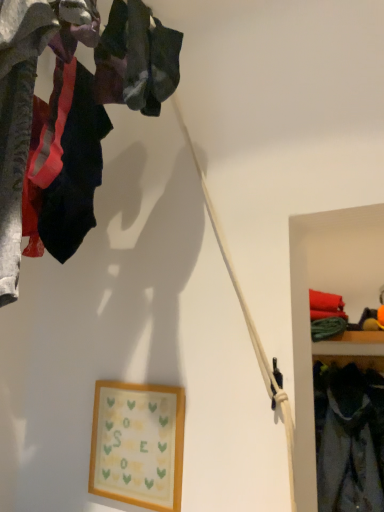
Find the location of `wooden framed picture at center`. wooden framed picture at center is located at coordinates (138, 444).

What do you see at coordinates (138, 444) in the screenshot? This screenshot has width=384, height=512. I see `wooden framed picture at center` at bounding box center [138, 444].

Where is `wooden framed picture at center`? The width and height of the screenshot is (384, 512). wooden framed picture at center is located at coordinates (138, 444).